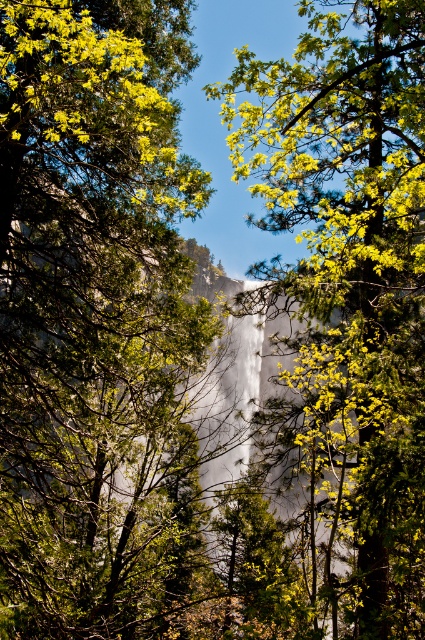
Looking at this image, who is positioned more to the left, green matte tree at upper left or green leafy tree at center?

green matte tree at upper left is more to the left.

Between green matte tree at upper left and green leafy tree at center, which one appears on the right side from the viewer's perspective?

From the viewer's perspective, green leafy tree at center appears more on the right side.

Which is behind, point (149, 596) or point (334, 60)?

The point (149, 596) is behind.

At what (x,y) coordinates should I click in order to perform the action: click on green matte tree at upper left. Please return your answer as a coordinate pair (x, y). Looking at the image, I should click on (96, 321).